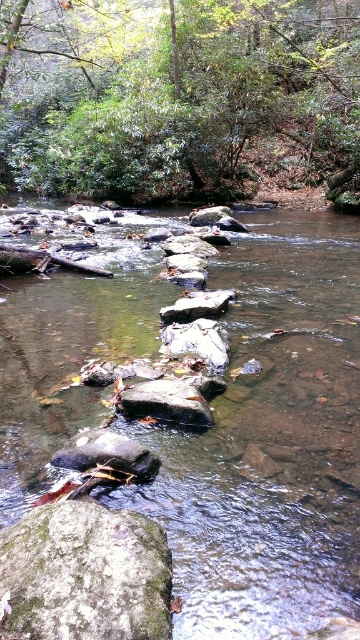
Question: Which point is closer to the camera taking this photo?

Choices:
 (A) (110, 317)
 (B) (74, 518)
 (C) (326, 92)
 (D) (64, 451)

Answer: (B)

Question: Which point appears closest to the camera in this image?

Choices:
 (A) (45, 189)
 (B) (135, 472)
 (C) (225, 304)

Answer: (B)

Question: Does smooth rock stream at center have a lesser width compared to green mossy rock at lower left?

Choices:
 (A) no
 (B) yes

Answer: (A)

Question: Based on their relative distances, which object is nearer to the gray smooth rock at center?

Choices:
 (A) green leafy tree at upper center
 (B) green mossy rock at lower left

Answer: (B)

Question: Where is green mossy rock at lower left located in relation to gray smooth rock at center in the image?

Choices:
 (A) above
 (B) below

Answer: (B)

Question: Does green mossy rock at lower left have a greater width compared to gray smooth rock at center?

Choices:
 (A) yes
 (B) no

Answer: (B)